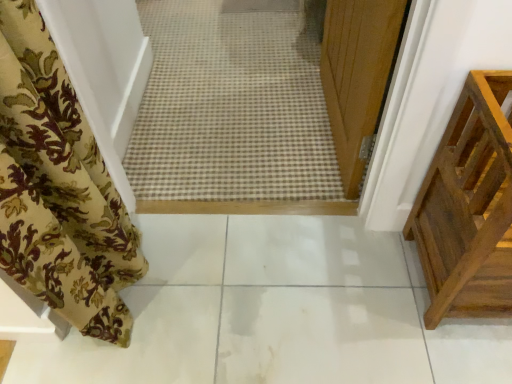
The height and width of the screenshot is (384, 512). In order to click on vacant space positioned to the left of brown wooden crate at right in this screenshot , I will do `click(366, 288)`.